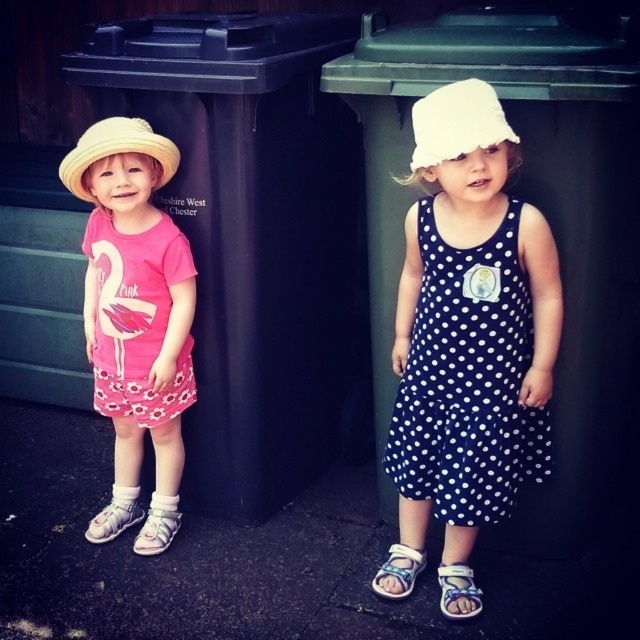
Question: Which object is farther from the camera taking this photo?

Choices:
 (A) blue fabric sandal at lower center
 (B) green plastic recycling bin at upper center
 (C) black plastic recycling bin at left

Answer: (A)

Question: Which point is closer to the camera taking this photo?

Choices:
 (A) (440, 444)
 (B) (326, 195)
 (C) (616, 314)

Answer: (A)

Question: Is straw hat at left further to camera compared to white fabric sandal at lower center?

Choices:
 (A) yes
 (B) no

Answer: (B)

Question: Is black plastic recycling bin at left to the right of navy polka dot dress at right from the viewer's perspective?

Choices:
 (A) yes
 (B) no

Answer: (B)

Question: From the image, what is the correct spatial relationship of matte pink dress at left in relation to white fabric sandal at lower center?

Choices:
 (A) above
 (B) below

Answer: (A)

Question: Which object is the closest to the straw hat at left?

Choices:
 (A) blue fabric sandal at lower center
 (B) black plastic recycling bin at left

Answer: (B)